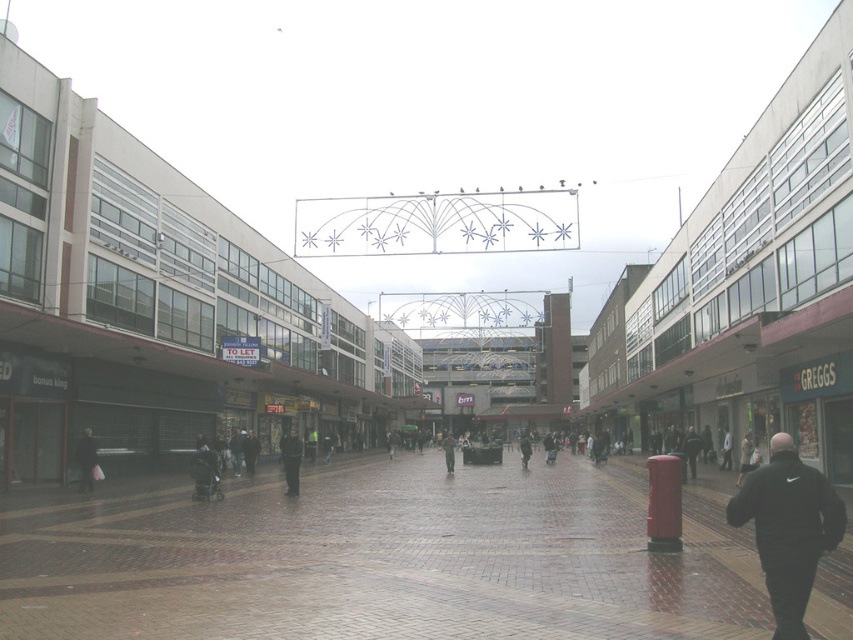
Where is `dark gray jacket at lower left`? This screenshot has height=640, width=853. dark gray jacket at lower left is located at coordinates (86, 460).

Can you confirm if dark gray jacket at lower left is positioned to the left of dark gray jacket at center?

Yes, dark gray jacket at lower left is to the left of dark gray jacket at center.

Is point (83, 458) farther from viewer compared to point (453, 470)?

No, it is not.

At what (x,y) coordinates should I click in order to perform the action: click on dark gray jacket at lower left. Please return your answer as a coordinate pair (x, y). The height and width of the screenshot is (640, 853). Looking at the image, I should click on (x=86, y=460).

In the scene shown: Who is shorter, dark gray jacket at center or black matte jacket at center?

Standing shorter between the two is black matte jacket at center.

Identify the location of dark gray jacket at center. This screenshot has height=640, width=853. [x=448, y=451].

Where is `dark gray jacket at center`? The image size is (853, 640). dark gray jacket at center is located at coordinates (448, 451).

Which of these two, dark gray jacket at lower left or black matte jacket at center, stands shorter?

Standing shorter between the two is dark gray jacket at lower left.

Consider the image. Does dark gray jacket at lower left have a greater height compared to black matte jacket at center?

In fact, dark gray jacket at lower left may be shorter than black matte jacket at center.

Who is more distant from viewer, [90,476] or [526,452]?

The point [526,452] is behind.

Image resolution: width=853 pixels, height=640 pixels. I want to click on dark gray jacket at lower left, so click(x=86, y=460).